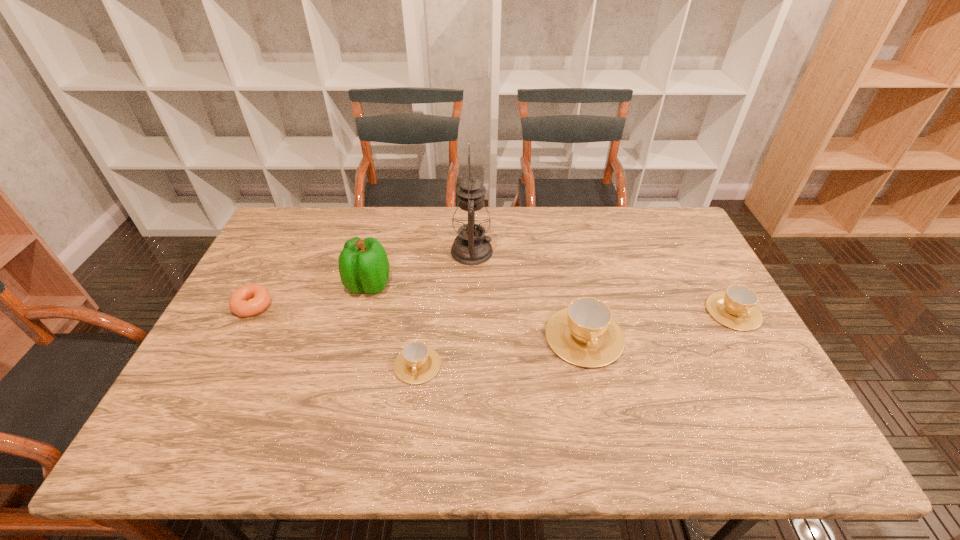
Find the location of a particular element. This screenshot has height=540, width=960. unoccupied area between the fourth shortest object and the fourth object from left to right is located at coordinates (528, 294).

Where is `free space between the second tallest cup and the farthest object`? free space between the second tallest cup and the farthest object is located at coordinates (603, 282).

At what (x,y) coordinates should I click in order to perform the action: click on empty space that is in between the bell pepper and the third shortest object. Please return your answer as a coordinate pair (x, y). Looking at the image, I should click on (551, 298).

You are a GUI agent. You are given a task and a screenshot of the screen. Output one action in this format:
    pyautogui.click(x=<x>, y=<y>)
    Task: Click on the object that stands as the fifth closest to the second object from right to left
    Image resolution: width=960 pixels, height=540 pixels.
    Given the screenshot: What is the action you would take?
    pyautogui.click(x=259, y=297)

Choose which object is the fifth nearest neighbor to the shortest cup. Please provide its 2D coordinates. Your answer should be formatted as a tuple, i.e. [(x, y)], where the tuple contains the x and y coordinates of a point satisfying the conditions above.

[(736, 308)]

The height and width of the screenshot is (540, 960). What are the coordinates of `cup identified as the second closest to the third object from left to right` in the screenshot? It's located at (736, 308).

Locate which cup is the closest to the rightmost cup. Please provide its 2D coordinates. Your answer should be formatted as a tuple, i.e. [(x, y)], where the tuple contains the x and y coordinates of a point satisfying the conditions above.

[(584, 334)]

Locate an element on the screen. This screenshot has width=960, height=540. free space that satisfies the following two spatial constraints: 1. on the back side of the bell pepper; 2. on the left side of the doughnut is located at coordinates (263, 285).